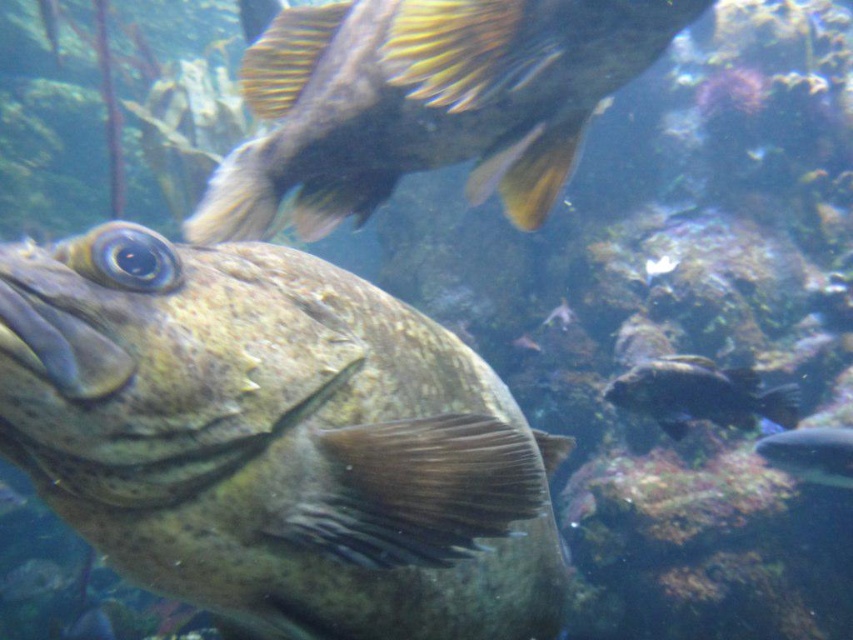
Question: Which point is farther to the camera?

Choices:
 (A) speckled brown fish at center
 (B) shiny black fish at upper center

Answer: (B)

Question: Can you confirm if speckled brown fish at center is smaller than shiny black fish at upper center?

Choices:
 (A) yes
 (B) no

Answer: (B)

Question: Does speckled brown fish at center come in front of speckled brown fish at lower right?

Choices:
 (A) yes
 (B) no

Answer: (A)

Question: Does shiny black fish at upper center have a smaller size compared to speckled brown fish at lower right?

Choices:
 (A) no
 (B) yes

Answer: (A)

Question: Which of the following is the closest to the observer?

Choices:
 (A) (825, 468)
 (B) (96, 305)
 (C) (500, 65)
 (D) (654, 412)

Answer: (B)

Question: Among these objects, which one is farthest from the camera?

Choices:
 (A) shiny black fish at upper center
 (B) speckled brown fish at lower right
 (C) speckled brown fish at center
 (D) dark brown textured fish at lower right

Answer: (B)